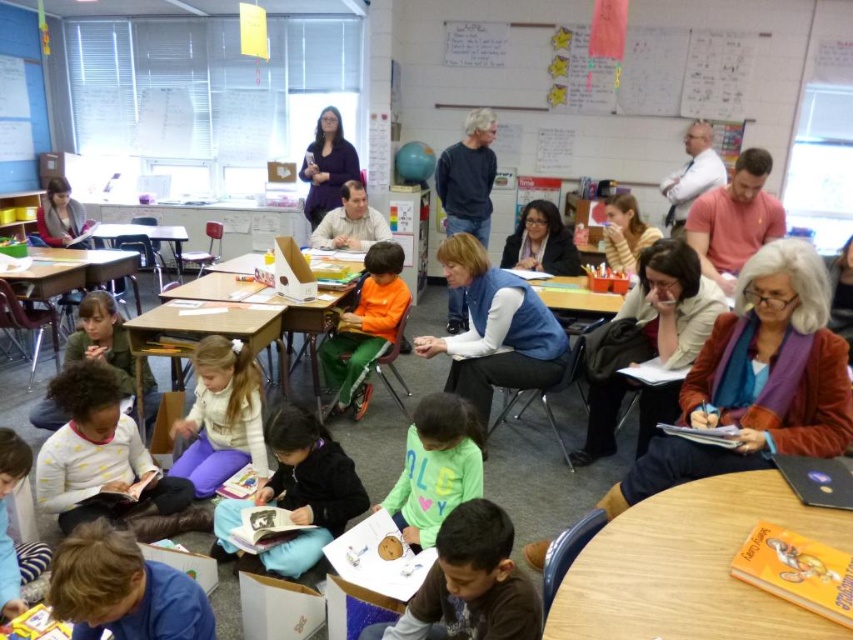
Is blue sweater at center bigger than white shirt at upper right?

Actually, blue sweater at center might be smaller than white shirt at upper right.

Does blue sweater at center lie in front of white shirt at upper right?

That is True.

Does point (473, 138) lie in front of point (691, 179)?

No, (473, 138) is behind (691, 179).

What are the coordinates of `blue sweater at center` in the screenshot? It's located at (x=468, y=177).

Measure the distance between brown hair at lower left and white soft sweater at center.

4.43 feet

Looking at this image, between brown hair at lower left and white soft sweater at center, which one appears on the right side from the viewer's perspective?

brown hair at lower left

Is point (61, 564) positioned after point (173, 464)?

No.

Where is `brown hair at lower left`? This screenshot has width=853, height=640. brown hair at lower left is located at coordinates (123, 589).

Is orange matte shirt at center positioned before light brown hair at lower left?

No, orange matte shirt at center is further to the viewer.

Is orange matte shirt at center shorter than light brown hair at lower left?

In fact, orange matte shirt at center may be taller than light brown hair at lower left.

Describe the element at coordinates (364, 326) in the screenshot. The image size is (853, 640). I see `orange matte shirt at center` at that location.

Where is `orange matte shirt at center`? The height and width of the screenshot is (640, 853). orange matte shirt at center is located at coordinates (364, 326).